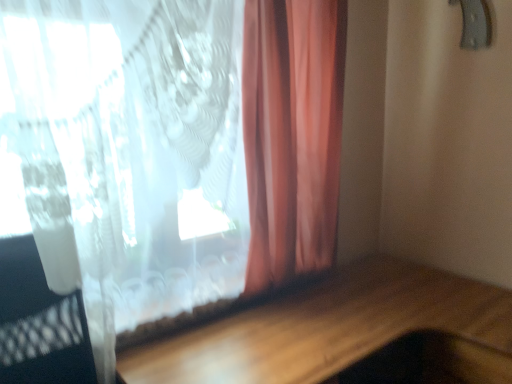
Question: Is metallic gray door handle at upper right bigger than wooden table at lower center?

Choices:
 (A) yes
 (B) no

Answer: (B)

Question: Does metallic gray door handle at upper right turn towards wooden table at lower center?

Choices:
 (A) no
 (B) yes

Answer: (A)

Question: Considering the relative positions of metallic gray door handle at upper right and wooden table at lower center in the image provided, is metallic gray door handle at upper right to the right of wooden table at lower center from the viewer's perspective?

Choices:
 (A) no
 (B) yes

Answer: (B)

Question: From the image's perspective, is metallic gray door handle at upper right over wooden table at lower center?

Choices:
 (A) yes
 (B) no

Answer: (A)

Question: Is metallic gray door handle at upper right not near wooden table at lower center?

Choices:
 (A) yes
 (B) no

Answer: (A)

Question: From the image's perspective, would you say metallic gray door handle at upper right is shown under wooden table at lower center?

Choices:
 (A) no
 (B) yes

Answer: (A)

Question: Is wooden table at lower center oriented away from translucent fabric curtain at upper left?

Choices:
 (A) yes
 (B) no

Answer: (B)

Question: Would you say translucent fabric curtain at upper left is part of wooden table at lower center's contents?

Choices:
 (A) no
 (B) yes

Answer: (A)

Question: Is wooden table at lower center at the right side of translucent fabric curtain at upper left?

Choices:
 (A) yes
 (B) no

Answer: (A)

Question: Considering the relative positions of wooden table at lower center and translucent fabric curtain at upper left in the image provided, is wooden table at lower center in front of translucent fabric curtain at upper left?

Choices:
 (A) yes
 (B) no

Answer: (A)

Question: From the image's perspective, is wooden table at lower center on top of translucent fabric curtain at upper left?

Choices:
 (A) no
 (B) yes

Answer: (A)

Question: From a real-world perspective, is wooden table at lower center physically above translucent fabric curtain at upper left?

Choices:
 (A) yes
 (B) no

Answer: (B)

Question: From a real-world perspective, is translucent fabric curtain at upper left physically below metallic gray door handle at upper right?

Choices:
 (A) no
 (B) yes

Answer: (B)